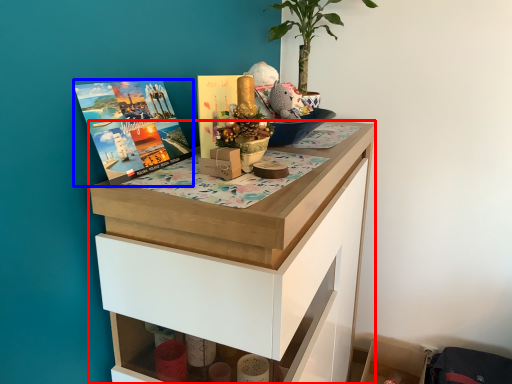
Question: Which object is closer to the camera taking this photo, chest of drawers (highlighted by a red box) or book cover (highlighted by a blue box)?

Choices:
 (A) chest of drawers
 (B) book cover

Answer: (A)